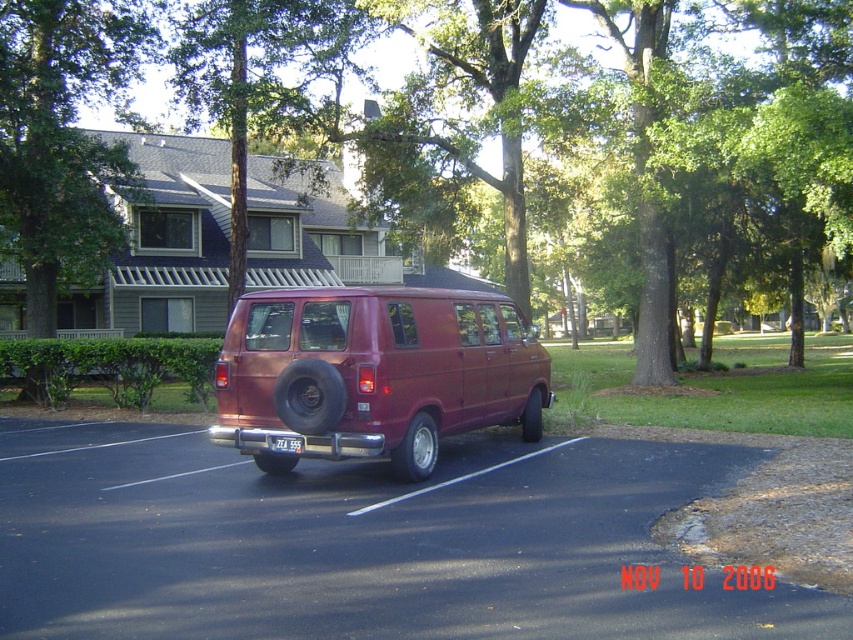
Question: Does green leafy tree at upper left come behind white plastic license plate at center?

Choices:
 (A) yes
 (B) no

Answer: (A)

Question: Is green leafy tree at center to the left of green leafy tree at upper center from the viewer's perspective?

Choices:
 (A) no
 (B) yes

Answer: (A)

Question: Which object appears closest to the camera in this image?

Choices:
 (A) white plastic license plate at center
 (B) green leafy tree at center

Answer: (A)

Question: Among these objects, which one is nearest to the camera?

Choices:
 (A) green leafy tree at center
 (B) satin burgundy van at center
 (C) white plastic license plate at center

Answer: (B)

Question: Can you confirm if black asphalt parking lot at center is positioned below green leafy tree at center?

Choices:
 (A) no
 (B) yes

Answer: (B)

Question: Which point is closer to the camera?

Choices:
 (A) (277, 449)
 (B) (772, 138)

Answer: (A)